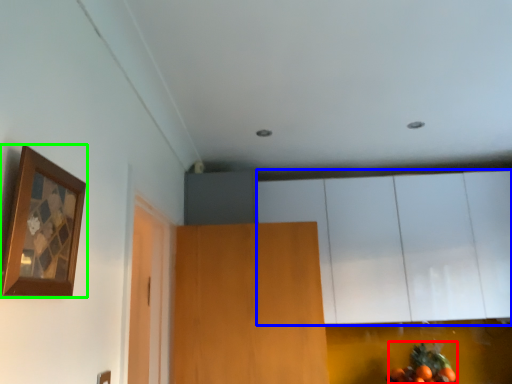
Question: Based on their relative distances, which object is farther from fruit (highlighted by a red box)? Choose from cabinetry (highlighted by a blue box) and picture frame (highlighted by a green box).

Choices:
 (A) cabinetry
 (B) picture frame

Answer: (B)